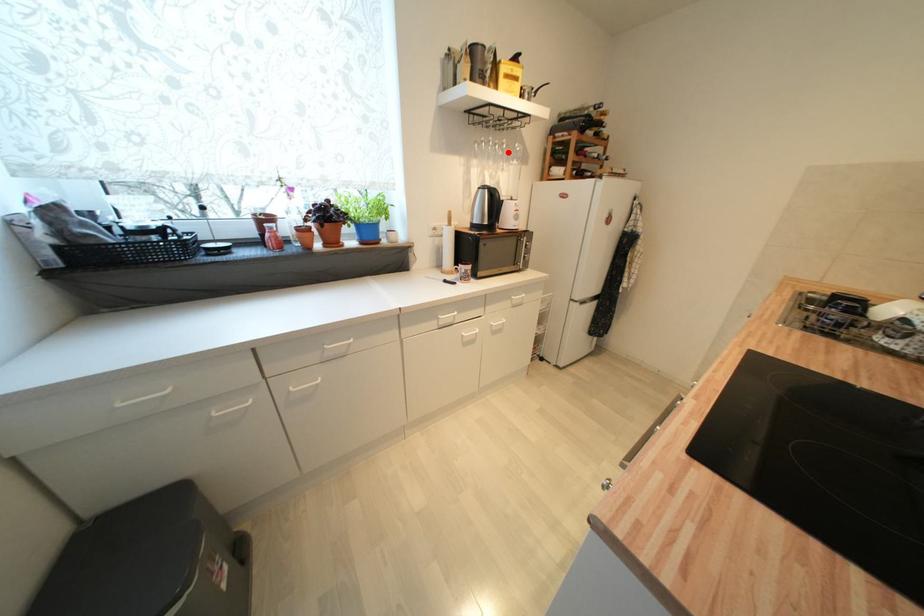
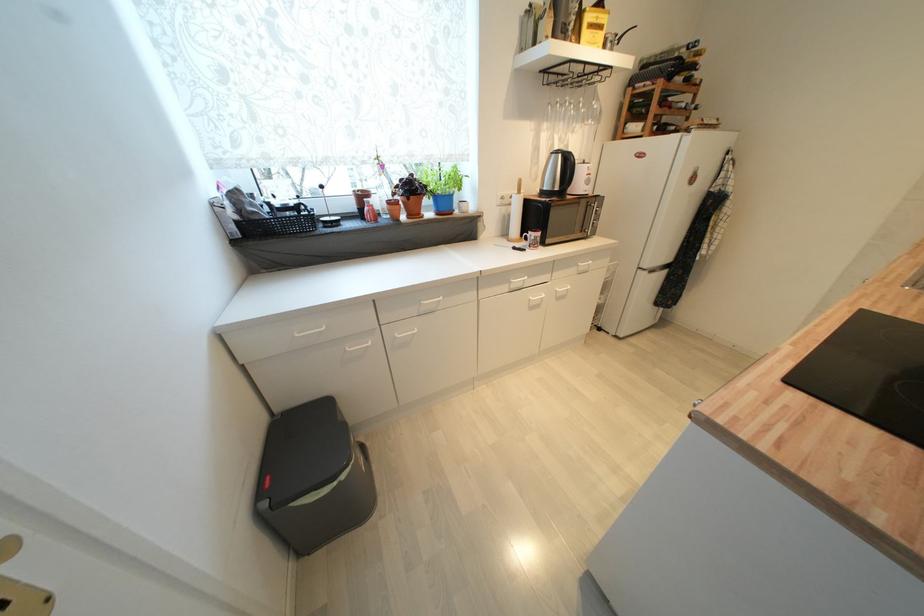
Locate, in the second image, the point that corresponds to the highlighted location in the first image.

(582, 111)